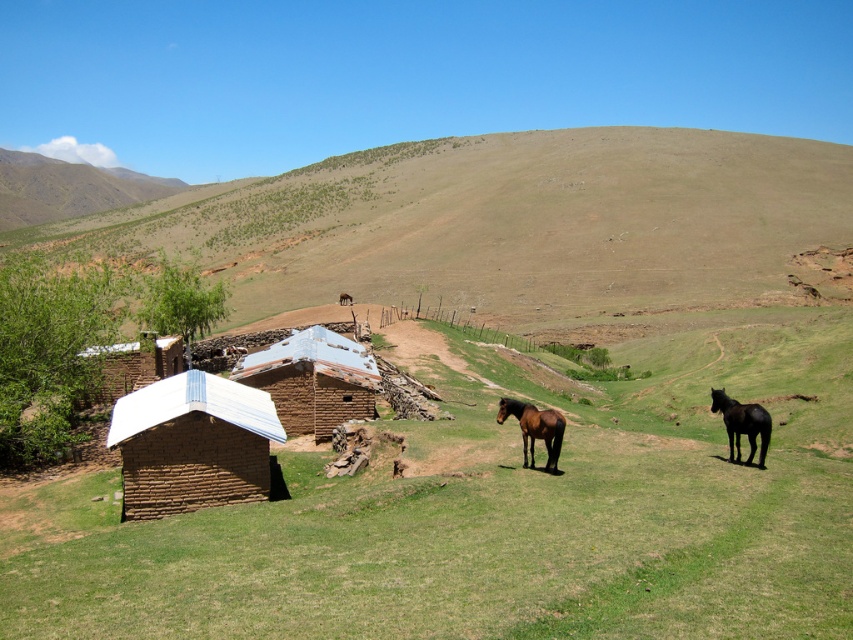
Between point (113, 410) and point (283, 400), which one is positioned behind?

Point (283, 400)

Who is taller, brown brick hut at center or brown clay hut at lower left?

Standing taller between the two is brown clay hut at lower left.

Does point (163, 497) come behind point (367, 372)?

That is False.

Where is `brown brick hut at center`? brown brick hut at center is located at coordinates (192, 444).

Who is more distant from viewer, [253,381] or [553,454]?

Positioned behind is point [253,381].

Which is in front, point (277, 385) or point (547, 413)?

Point (547, 413)

Is point (308, 396) in front of point (521, 435)?

No, it is behind (521, 435).

The image size is (853, 640). Identify the location of brown clay hut at lower left. (312, 380).

In the scene shown: Is brown grassy hillside at upper center positioned before brown clay hut at lower left?

No, brown grassy hillside at upper center is further to the viewer.

Between brown grassy hillside at upper center and brown clay hut at lower left, which one appears on the right side from the viewer's perspective?

brown clay hut at lower left

Locate an element on the screen. brown grassy hillside at upper center is located at coordinates 506,224.